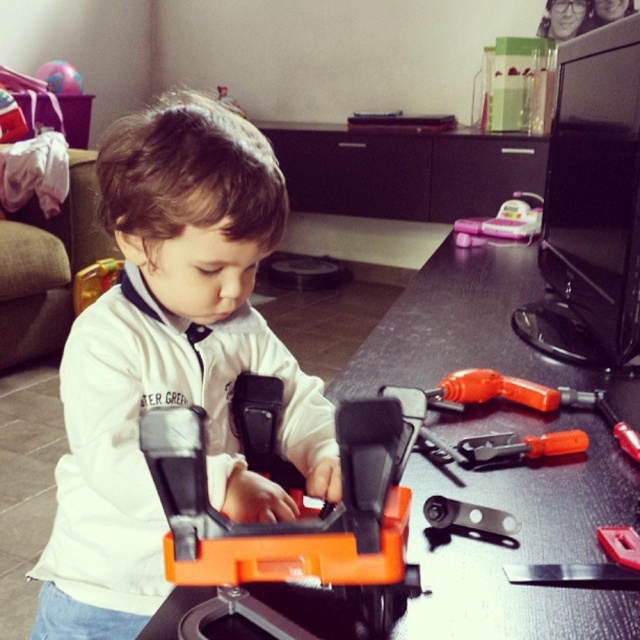
Question: Among these objects, which one is nearest to the camera?

Choices:
 (A) orange plastic tool at lower right
 (B) black glossy table at center
 (C) white matte shirt at center

Answer: (B)

Question: Does orange plastic tool at center appear under orange plastic screwdriver at center?

Choices:
 (A) yes
 (B) no

Answer: (A)

Question: Considering the real-world distances, which object is closest to the black plastic tool at center?

Choices:
 (A) orange plastic screwdriver at center
 (B) orange plastic tool at lower right
 (C) pink plastic toy at upper right

Answer: (B)

Question: Can you confirm if white matte shirt at center is positioned above black plastic tool at center?

Choices:
 (A) no
 (B) yes

Answer: (B)

Question: Which point is closer to the camera?

Choices:
 (A) black plastic tool at center
 (B) orange plastic screwdriver at center
 (C) orange plastic tool at center
 (D) pink plastic toy at upper right

Answer: (C)

Question: Can you confirm if orange plastic tool at center is positioned to the left of orange plastic screwdriver at center?

Choices:
 (A) no
 (B) yes

Answer: (B)